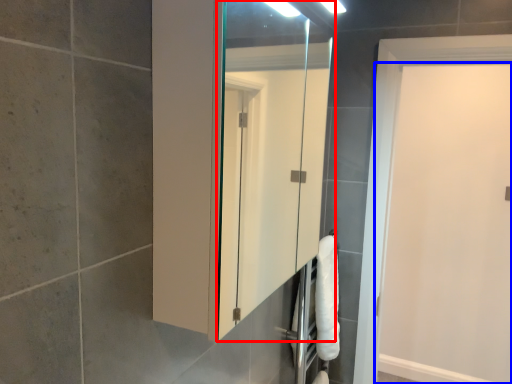
Question: Which of the following is the closest to the observer, mirror (highlighted by a red box) or door (highlighted by a blue box)?

Choices:
 (A) mirror
 (B) door

Answer: (A)